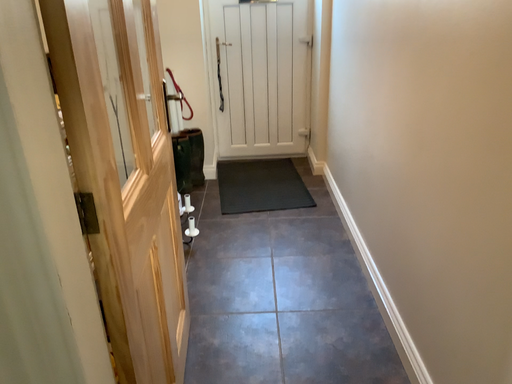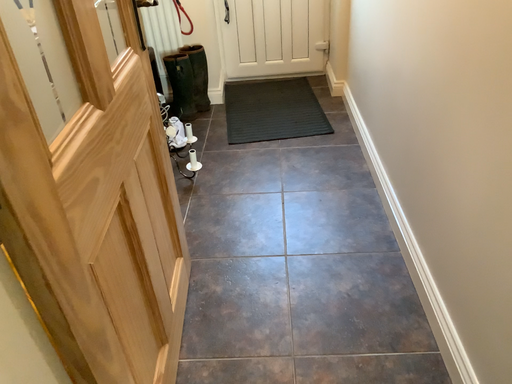
Question: How did the camera likely rotate when shooting the video?

Choices:
 (A) rotated upward
 (B) rotated downward

Answer: (B)